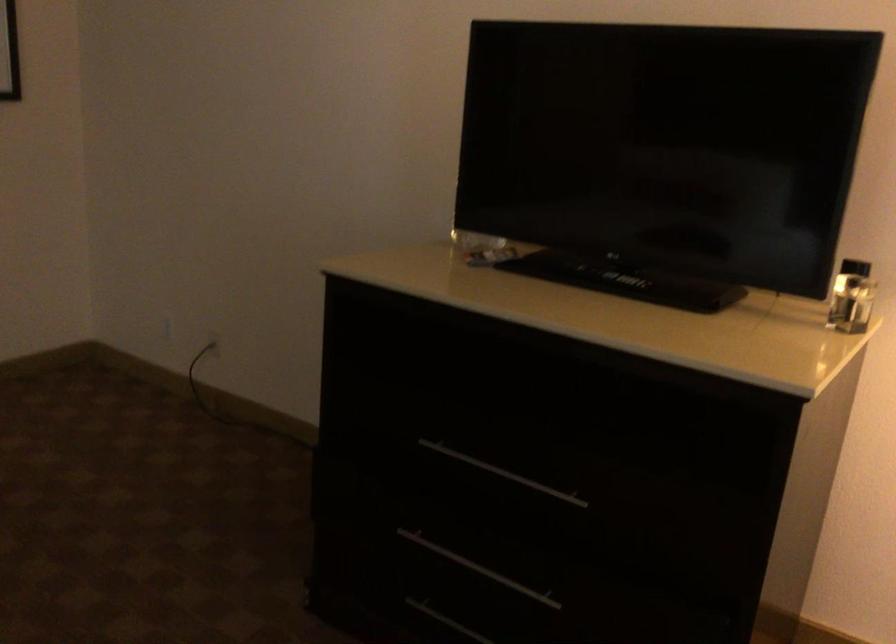
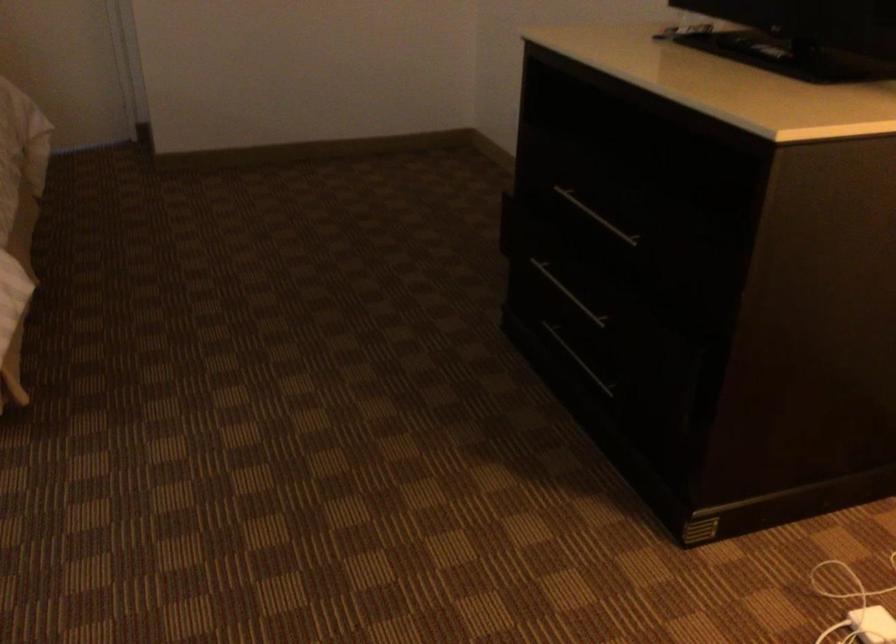
Question: The camera is either moving clockwise (left) or counter-clockwise (right) around the object. The first image is from the beginning of the video and the second image is from the end. Is the camera moving left or right when shooting the video?

Choices:
 (A) Left
 (B) Right

Answer: (B)